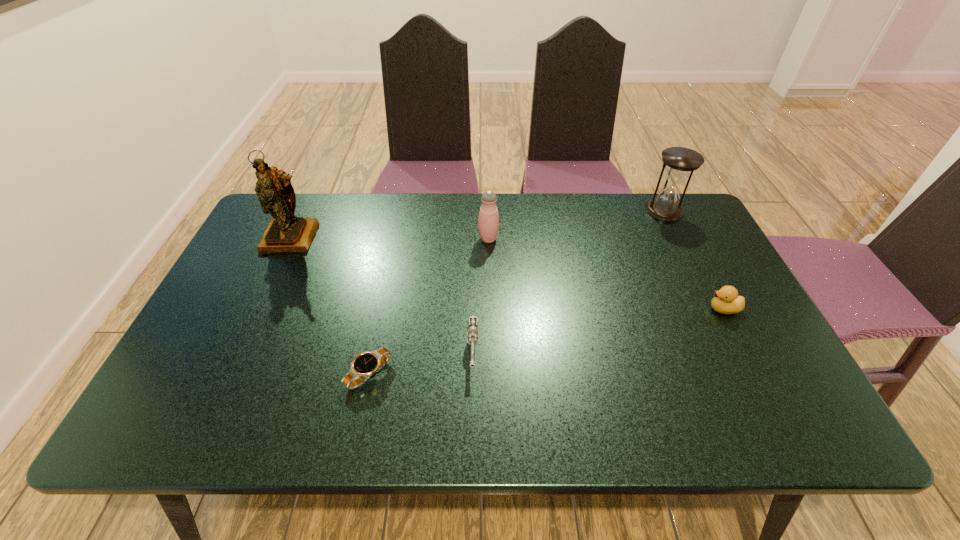
I want to click on free space located 0.290m on the right of the thermos bottle, so click(x=595, y=239).

I want to click on blank space located facing forward on the duckling, so click(648, 309).

Identify the location of vacant point located 0.370m facing forward on the duckling. The width and height of the screenshot is (960, 540). (562, 309).

In order to click on vacant space located facing forward on the duckling in this screenshot , I will do `click(605, 309)`.

Where is `free region located 0.080m aimed along the barrel of the gun`? The image size is (960, 540). free region located 0.080m aimed along the barrel of the gun is located at coordinates (472, 411).

Find the location of a particular element. The image size is (960, 540). free space located 0.350m on the left of the fifth object from right to left is located at coordinates (191, 374).

You are a GUI agent. You are given a task and a screenshot of the screen. Output one action in this format:
    pyautogui.click(x=<x>, y=<y>)
    Task: Click on the figurine that is at the far edge
    This screenshot has height=540, width=960.
    Given the screenshot: What is the action you would take?
    pyautogui.click(x=285, y=233)

At what (x,y) coordinates should I click in order to perform the action: click on hourglass that is at the far edge. Please return your answer as a coordinate pair (x, y). The height and width of the screenshot is (540, 960). Looking at the image, I should click on (680, 162).

Locate an element on the screen. The image size is (960, 540). thermos bottle that is at the far edge is located at coordinates (488, 222).

Locate an element on the screen. The height and width of the screenshot is (540, 960). object present at the left edge is located at coordinates (285, 233).